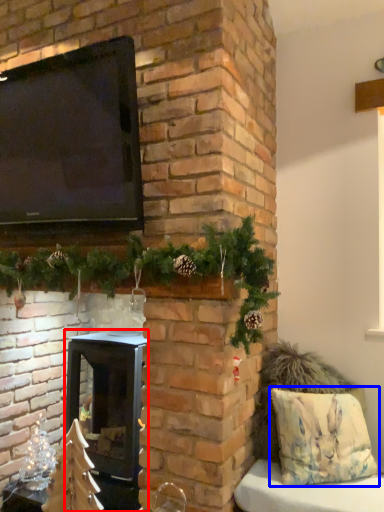
Question: Which point is closer to the camera, wood burning stove (highlighted by a red box) or pillow (highlighted by a blue box)?

Choices:
 (A) wood burning stove
 (B) pillow

Answer: (B)